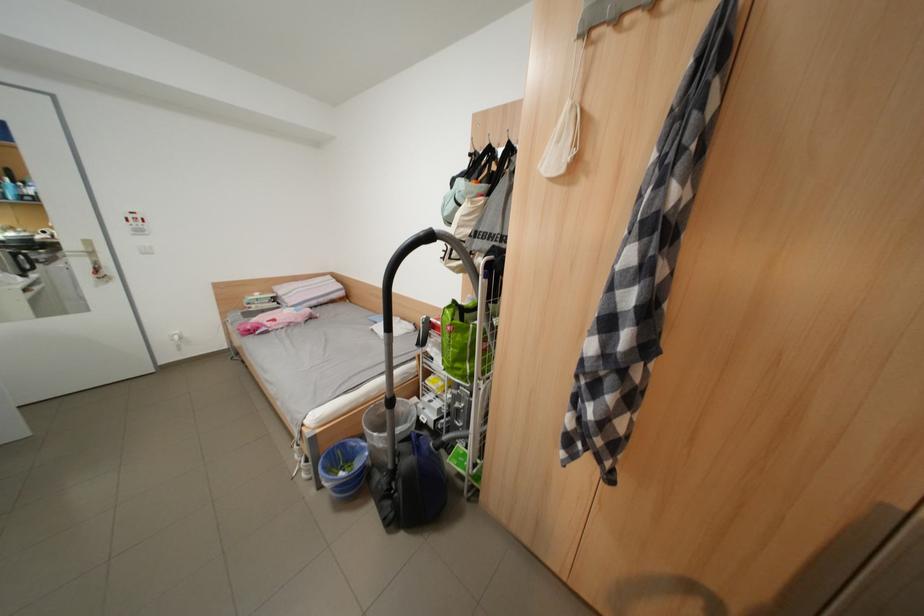
Where is `white power outlet`? The image size is (924, 616). white power outlet is located at coordinates (176, 338).